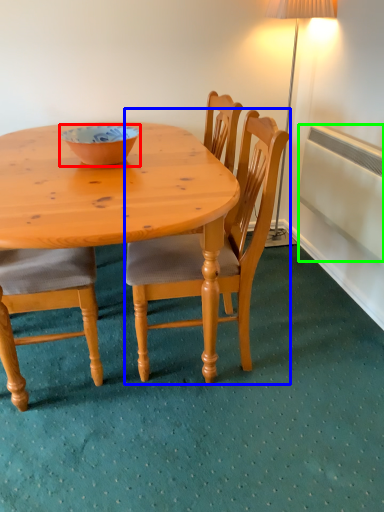
Question: Based on their relative distances, which object is farther from bowl (highlighted by a red box)? Choose from chair (highlighted by a blue box) and radiator (highlighted by a green box).

Choices:
 (A) chair
 (B) radiator

Answer: (B)